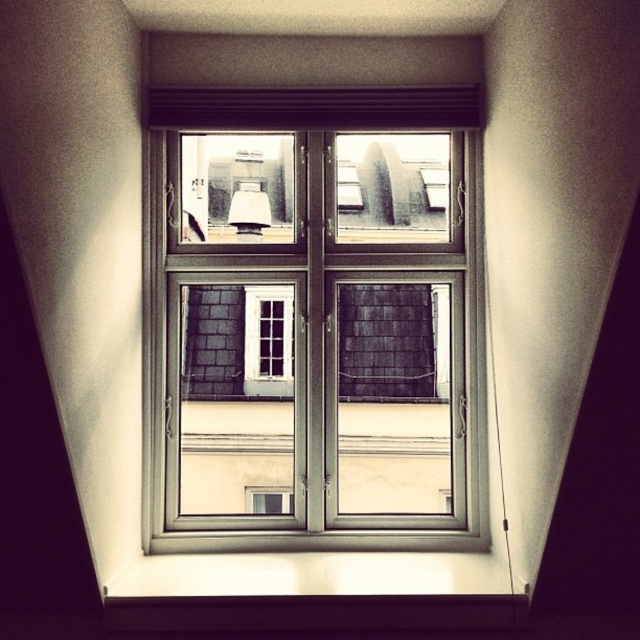
Question: Which object appears closest to the camera in this image?

Choices:
 (A) metallic silver window at center
 (B) matte white lampshade at upper center

Answer: (A)

Question: Can you confirm if metallic silver window at center is wider than matte white lampshade at upper center?

Choices:
 (A) yes
 (B) no

Answer: (A)

Question: Considering the relative positions of metallic silver window at center and matte white lampshade at upper center in the image provided, where is metallic silver window at center located with respect to matte white lampshade at upper center?

Choices:
 (A) above
 (B) below

Answer: (B)

Question: Is metallic silver window at center bigger than matte white lampshade at upper center?

Choices:
 (A) yes
 (B) no

Answer: (A)